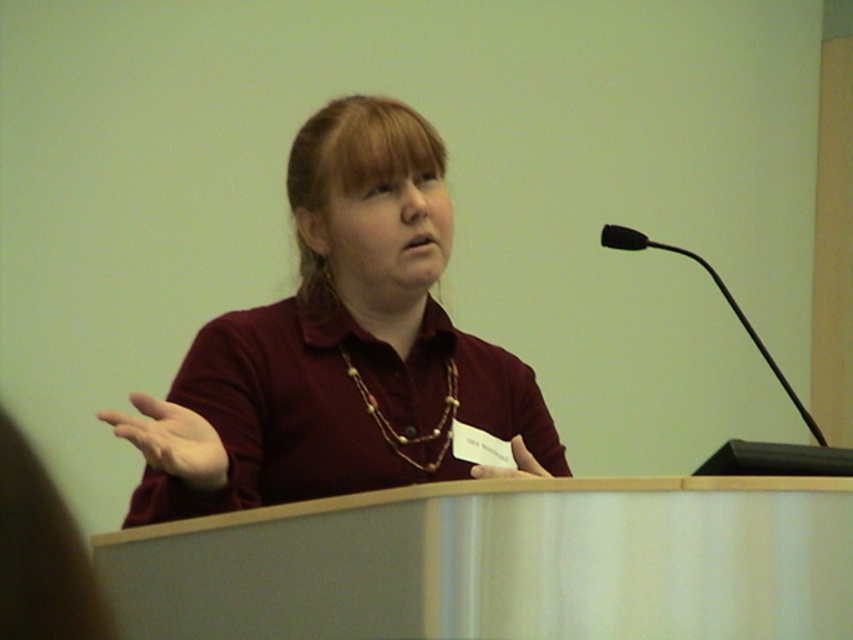
You are a photographer standing at a distance. You want to take a closeup photo of the maroon fabric shirt at center. Considering the distance between you and the shirt, is it advisable to use a standard lens with a focal length of 50mm or a telephoto lens with a focal length of 200mm? Explain your choice based on the distance provided.

The maroon fabric shirt at center and viewer are 1.16 meters apart from each other. A telephoto lens with a focal length of 200mm would be more advisable because it allows for a closer focus on the subject from a distance without needing to get physically closer, which is ideal for maintaining the current separation of 1.16 meters.

You are a photographer adjusting your camera settings to focus on two points in the scene. The first point is point (375, 310) and the second point is point (431, 468). Which point should you focus on first if you want to ensure the closest object is in sharp focus?

You should focus on point (375, 310) first because it is closer to the camera than point (431, 468), ensuring the closest object is in sharp focus.

You are an event organizer who needs to place a name tag on the maroon fabric shirt at center. Where exactly should you place it?

The maroon fabric shirt at center is located at point (339, 346), so place the name tag there.